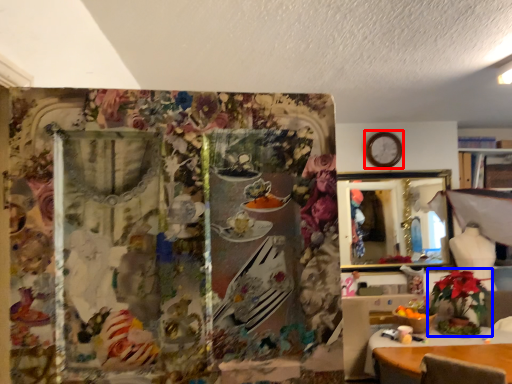
Question: Which of the following is the closest to the observer, clock (highlighted by a red box) or houseplant (highlighted by a blue box)?

Choices:
 (A) clock
 (B) houseplant

Answer: (B)